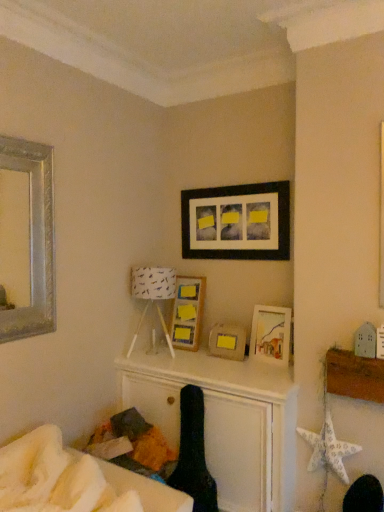
Question: Is there a large distance between white fabric lampshade at center and black fabric swivel chair at center?

Choices:
 (A) no
 (B) yes

Answer: (A)

Question: Does white fabric lampshade at center have a larger size compared to black fabric swivel chair at center?

Choices:
 (A) no
 (B) yes

Answer: (B)

Question: Could black fabric swivel chair at center be considered to be inside white fabric lampshade at center?

Choices:
 (A) yes
 (B) no

Answer: (B)

Question: Does white fabric lampshade at center have a smaller size compared to black fabric swivel chair at center?

Choices:
 (A) yes
 (B) no

Answer: (B)

Question: Can you confirm if white fabric lampshade at center is shorter than black fabric swivel chair at center?

Choices:
 (A) no
 (B) yes

Answer: (B)

Question: Could you tell me if white fabric lampshade at center is turned towards black fabric swivel chair at center?

Choices:
 (A) yes
 (B) no

Answer: (B)

Question: Is white paper star at lower right to the left of silver metallic mirror at upper left, which is counted as the first picture frame, starting from the left, from the viewer's perspective?

Choices:
 (A) no
 (B) yes

Answer: (A)

Question: Is white paper star at lower right next to silver metallic mirror at upper left, which is counted as the first picture frame, starting from the left?

Choices:
 (A) yes
 (B) no

Answer: (B)

Question: Is white paper star at lower right behind silver metallic mirror at upper left, the 5th picture frame when ordered from right to left?

Choices:
 (A) yes
 (B) no

Answer: (A)

Question: Is white paper star at lower right bigger than silver metallic mirror at upper left, the 5th picture frame when ordered from right to left?

Choices:
 (A) yes
 (B) no

Answer: (B)

Question: Is white paper star at lower right facing towards silver metallic mirror at upper left, which is counted as the first picture frame, starting from the left?

Choices:
 (A) no
 (B) yes

Answer: (A)

Question: Is white paper star at lower right taller than silver metallic mirror at upper left, the 5th picture frame when ordered from right to left?

Choices:
 (A) yes
 (B) no

Answer: (B)

Question: Is white fabric lampshade at center far from matte wooden picture frame at center-right, which is the fifth picture frame from left to right?

Choices:
 (A) yes
 (B) no

Answer: (B)